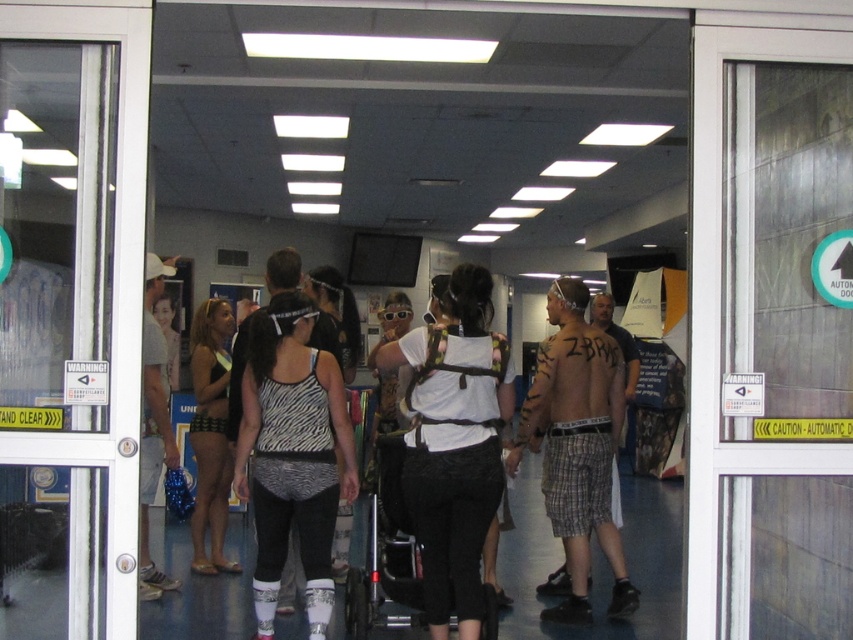
You are standing in the gym and see two points marked on the floor. The first point is at coordinates point (218,307) and the second point is at point (157,364). Which point is closer to you?

Point (218,307) is further to the viewer than point (157,364), so the second point is closer to you.

You are a photographer planning to take a photo of the black swimsuit at center and the white matte tank top at left. Since you want to ensure both are visible in the frame, which one should you focus on first to account for their sizes?

The black swimsuit at center is shorter than the white matte tank top at left, so you should focus on the white matte tank top at left first to ensure it is in focus before adjusting for the smaller black swimsuit at center.